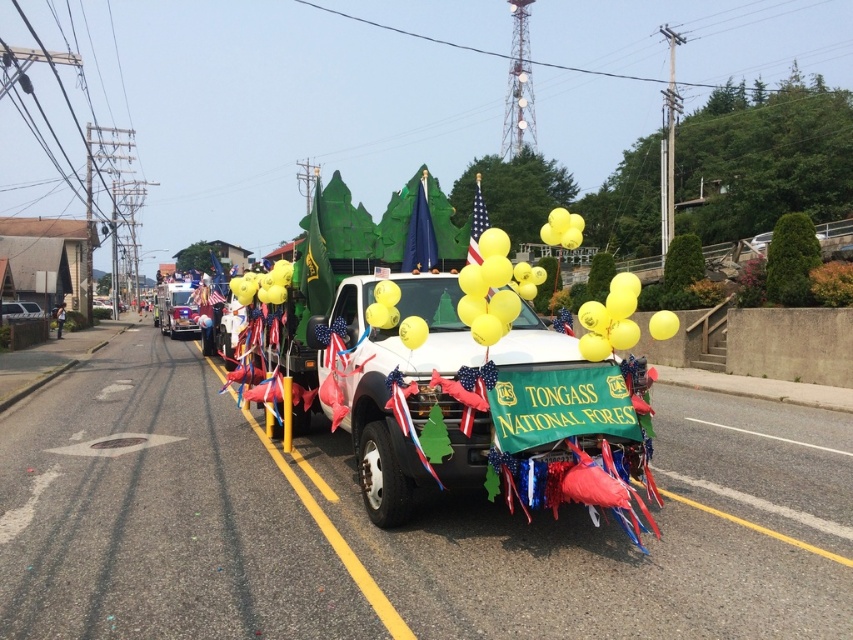
Question: Which object is farther from the camera taking this photo?

Choices:
 (A) metallic silver car at left
 (B) yellow matte balloon at center
 (C) navy blue fabric flag at center
 (D) american flag at center

Answer: (A)

Question: Which point is farther from the camera taking this photo?

Choices:
 (A) (421, 253)
 (B) (195, 312)
 (C) (482, 227)

Answer: (B)

Question: Is white glossy pickup truck at center further to camera compared to navy blue fabric flag at center?

Choices:
 (A) yes
 (B) no

Answer: (B)

Question: Can you confirm if shiny silver firetruck at center is bigger than american flag at center?

Choices:
 (A) yes
 (B) no

Answer: (B)

Question: Can you confirm if navy blue fabric flag at center is bigger than american flag at center?

Choices:
 (A) no
 (B) yes

Answer: (A)

Question: Estimate the real-world distances between objects in this image. Which object is closer to the white glossy pickup truck at center?

Choices:
 (A) metallic silver car at left
 (B) american flag at center
 (C) navy blue fabric flag at center
 (D) yellow matte balloon at center

Answer: (D)